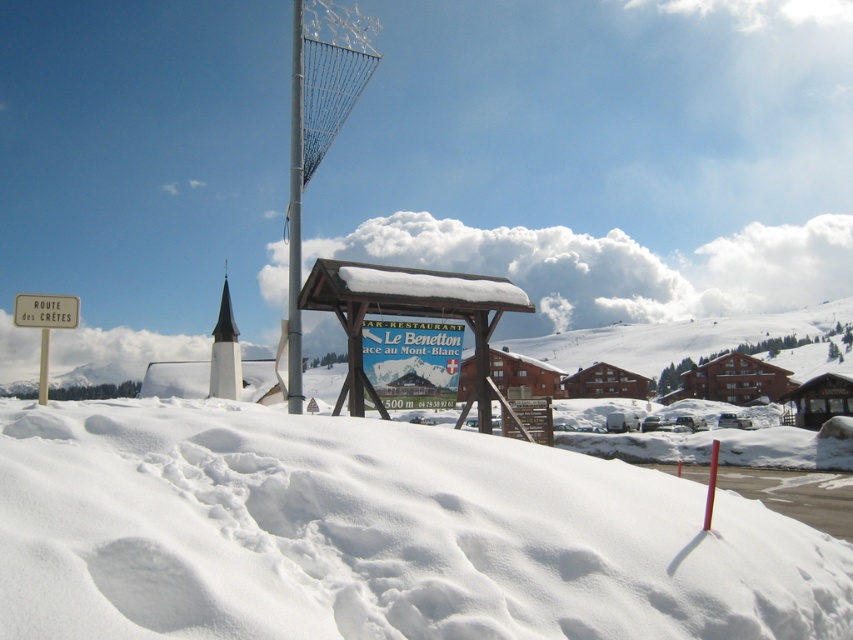
You are an explorer trying to navigate through the white powdery snow at lower center and the white wooden sign at left. Which object is closer to you as you approach the scene?

The white powdery snow at lower center is closer to you because it is in front of the white wooden sign at left.

You are an outdoor enthusiast planning to take a photo of the white powdery snow at lower center and the white wooden sign at upper left. Since both are white, how can you ensure they are distinguishable in your photo?

The white powdery snow at lower center has a lesser width compared to the white wooden sign at upper left, so you can differentiate them by their size in the photo.